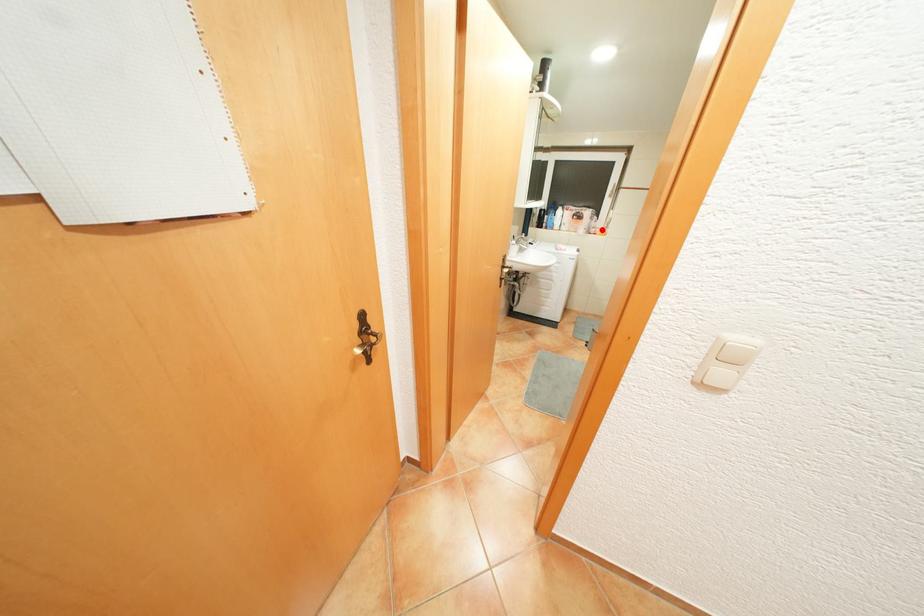
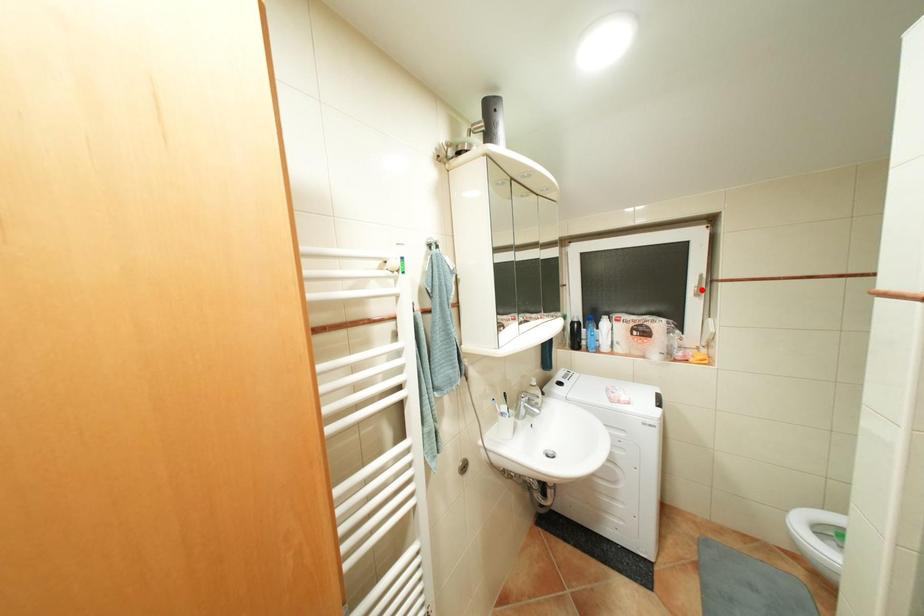
I am providing you with two images of the same scene from different viewpoints. A red point is marked on the first image and another point is marked on the second image. Do the highlighted points in image1 and image2 indicate the same real-world spot?

No